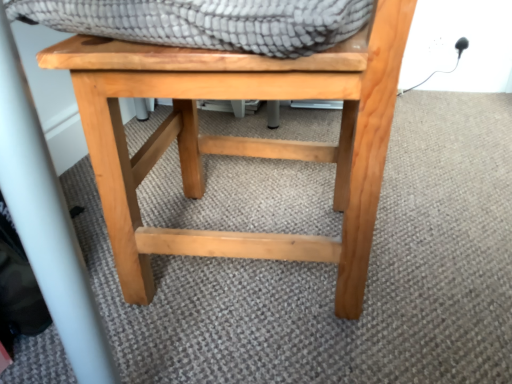
Identify the location of vacant space to the right of natural wood stool at center. This screenshot has height=384, width=512. (444, 235).